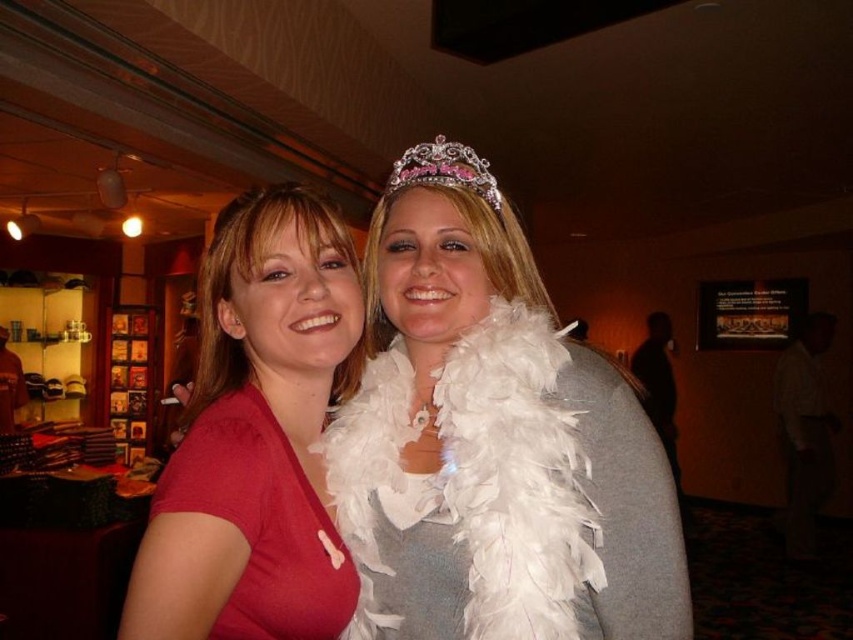
Is white feather boa at center smaller than matte red dress at left?

Incorrect, white feather boa at center is not smaller in size than matte red dress at left.

Where is `white feather boa at center`? This screenshot has width=853, height=640. white feather boa at center is located at coordinates (492, 451).

Does point (187, 609) lie behind point (265, 412)?

No, (187, 609) is in front of (265, 412).

This screenshot has width=853, height=640. Identify the location of matte red shirt at center. (257, 438).

Which is in front, point (257, 564) or point (426, 157)?

Point (257, 564) is more forward.

Is point (155, 589) farther from camera compared to point (461, 163)?

That is False.

Is point (235, 388) positioned after point (387, 176)?

No, (235, 388) is closer to viewer.

You are a GUI agent. You are given a task and a screenshot of the screen. Output one action in this format:
    pyautogui.click(x=<x>, y=<y>)
    Task: Click on the matte red shirt at center
    This screenshot has width=853, height=640.
    Given the screenshot: What is the action you would take?
    pyautogui.click(x=257, y=438)